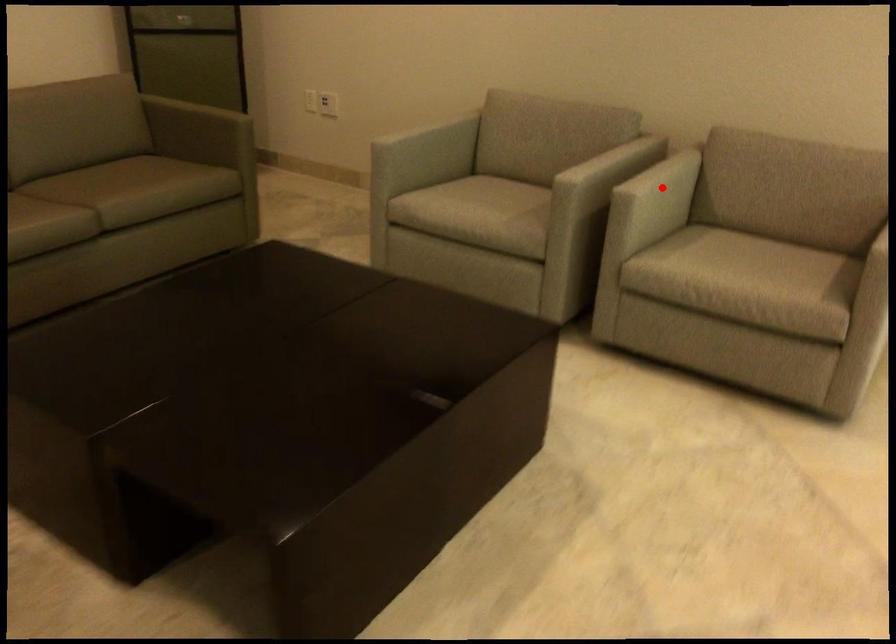
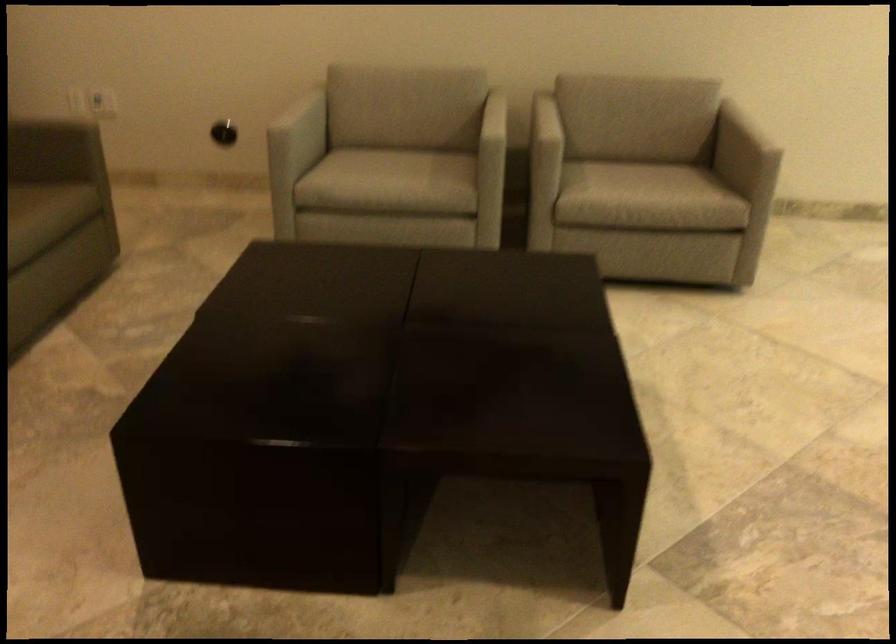
Where in the second image is the point corresponding to the highlighted location from the first image?

(543, 126)